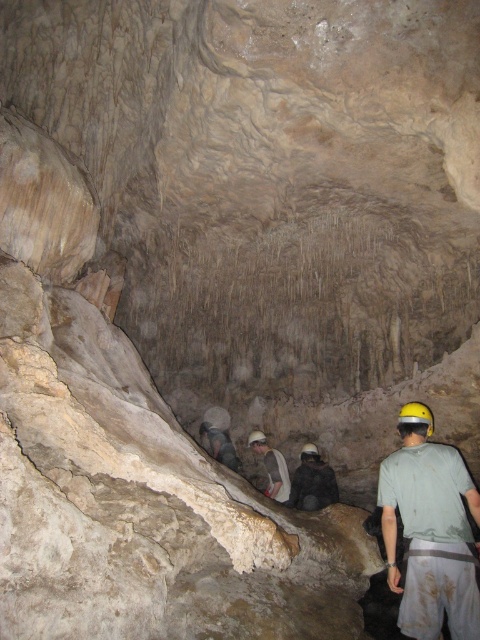
Can you confirm if dark gray fabric construction worker at center is smaller than white hard hat at center?

Indeed, dark gray fabric construction worker at center has a smaller size compared to white hard hat at center.

Is point (300, 483) closer to camera compared to point (289, 486)?

Yes, point (300, 483) is in front of point (289, 486).

Is point (334, 472) more distant than point (252, 442)?

That is False.

Identify the location of dark gray fabric construction worker at center. This screenshot has height=640, width=480. (312, 481).

How distant is yellow hard hat at center from white hard hat at center?

yellow hard hat at center and white hard hat at center are 3.73 meters apart.

Which is above, yellow hard hat at center or white hard hat at center?

yellow hard hat at center

Which is in front, point (396, 497) or point (284, 474)?

Point (396, 497) is more forward.

Where is `yellow hard hat at center`? yellow hard hat at center is located at coordinates (430, 531).

Does yellow hard hat at center have a lesser height compared to dark gray fabric construction worker at center?

No.

Does yellow hard hat at center have a smaller size compared to dark gray fabric construction worker at center?

No, yellow hard hat at center is not smaller than dark gray fabric construction worker at center.

The height and width of the screenshot is (640, 480). What do you see at coordinates (430, 531) in the screenshot?
I see `yellow hard hat at center` at bounding box center [430, 531].

Where is `yellow hard hat at center`? yellow hard hat at center is located at coordinates (430, 531).